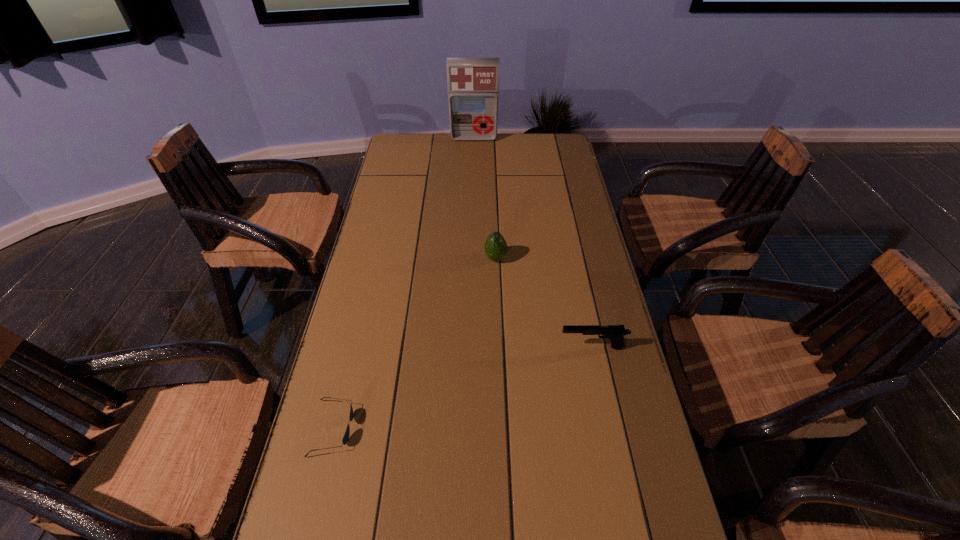
Locate an element on the screen. The image size is (960, 540). the first-aid kit is located at coordinates (473, 83).

In order to click on the tallest object in this screenshot , I will do `click(473, 83)`.

At what (x,y) coordinates should I click in order to perform the action: click on the second farthest object. Please return your answer as a coordinate pair (x, y). Looking at the image, I should click on tap(495, 248).

Identify the location of the rightmost object. This screenshot has height=540, width=960. coord(616,333).

At what (x,y) coordinates should I click in order to perform the action: click on gun. Please return your answer as a coordinate pair (x, y). This screenshot has width=960, height=540. Looking at the image, I should click on (616, 333).

Find the location of a particular element. the shortest object is located at coordinates (345, 439).

At what (x,y) coordinates should I click in order to perform the action: click on the leftmost object. Please return your answer as a coordinate pair (x, y). Looking at the image, I should click on (345, 439).

At what (x,y) coordinates should I click in order to perform the action: click on free point located on the front-facing side of the tallest object. Please return your answer as a coordinate pair (x, y). Looking at the image, I should click on (473, 176).

Find the location of `free space located on the left of the third nearest object`. free space located on the left of the third nearest object is located at coordinates (398, 258).

Identify the location of vacant space located 0.190m at the aiming end of the rightmost object. (487, 347).